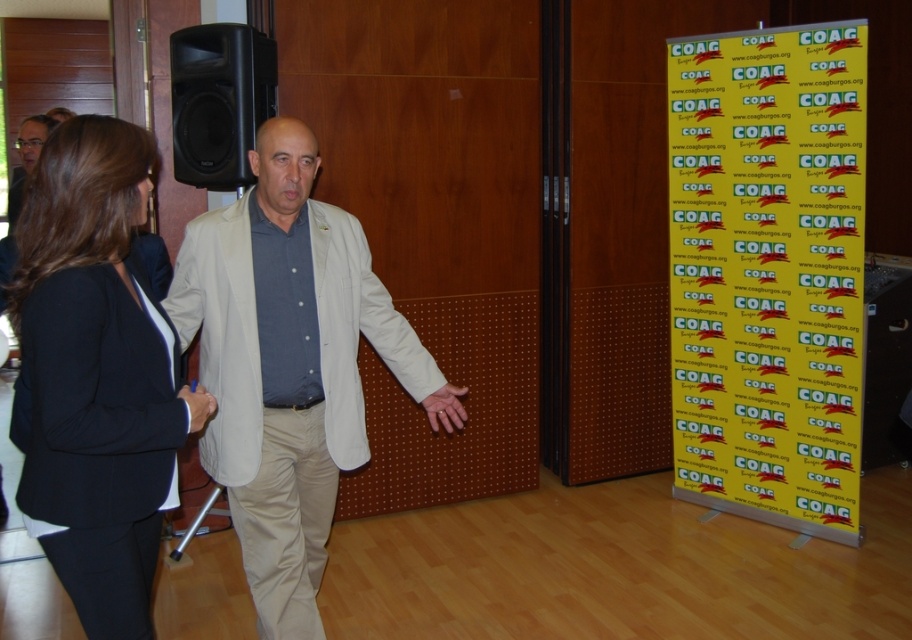
Question: Can you confirm if beige fabric jacket at center is positioned above black plastic speaker at upper left?

Choices:
 (A) yes
 (B) no

Answer: (B)

Question: Is beige fabric jacket at center to the left of satin black pen at center from the viewer's perspective?

Choices:
 (A) no
 (B) yes

Answer: (A)

Question: Considering the real-world distances, which object is closest to the beige fabric jacket at center?

Choices:
 (A) satin black pen at center
 (B) matte black jacket at upper left
 (C) black fabric suit at left

Answer: (C)

Question: Which point appears farthest from the camera in this image?

Choices:
 (A) (17, 138)
 (B) (464, 390)
 (C) (403, 326)
 (D) (774, 168)

Answer: (A)

Question: Is yellow paper at right wider than matte black jacket at upper left?

Choices:
 (A) no
 (B) yes

Answer: (A)

Question: Which of the following is the closest to the observer?

Choices:
 (A) beige fabric jacket at center
 (B) matte black jacket at upper left

Answer: (A)